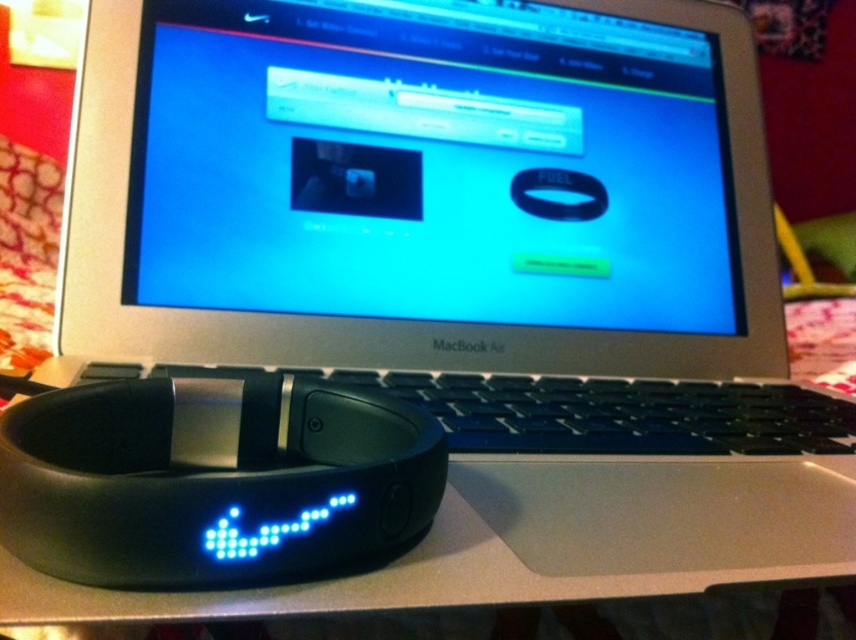
Can you confirm if black matte wristband at lower left is thinner than black matte nike fuelband at lower left?

In fact, black matte wristband at lower left might be wider than black matte nike fuelband at lower left.

Locate an element on the screen. This screenshot has width=856, height=640. black matte wristband at lower left is located at coordinates (566, 500).

At what (x,y) coordinates should I click in order to perform the action: click on black matte wristband at lower left. Please return your answer as a coordinate pair (x, y). The image size is (856, 640). Looking at the image, I should click on (566, 500).